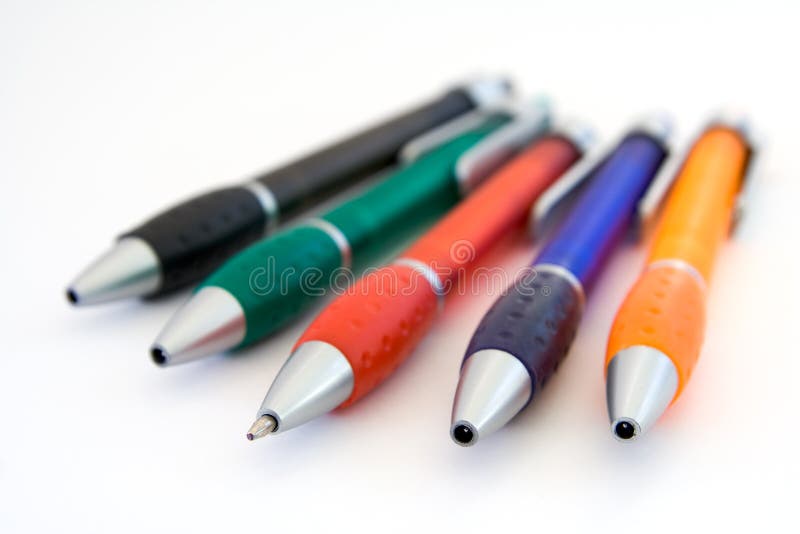
Find the location of a particular element. The width and height of the screenshot is (800, 534). pens is located at coordinates [x=161, y=247], [x=264, y=295], [x=354, y=340], [x=502, y=360], [x=641, y=369].